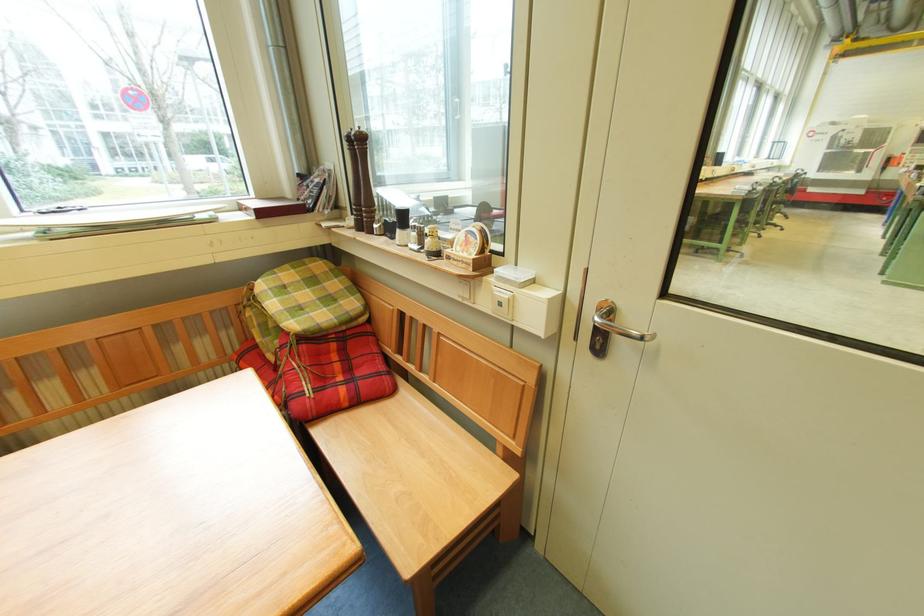
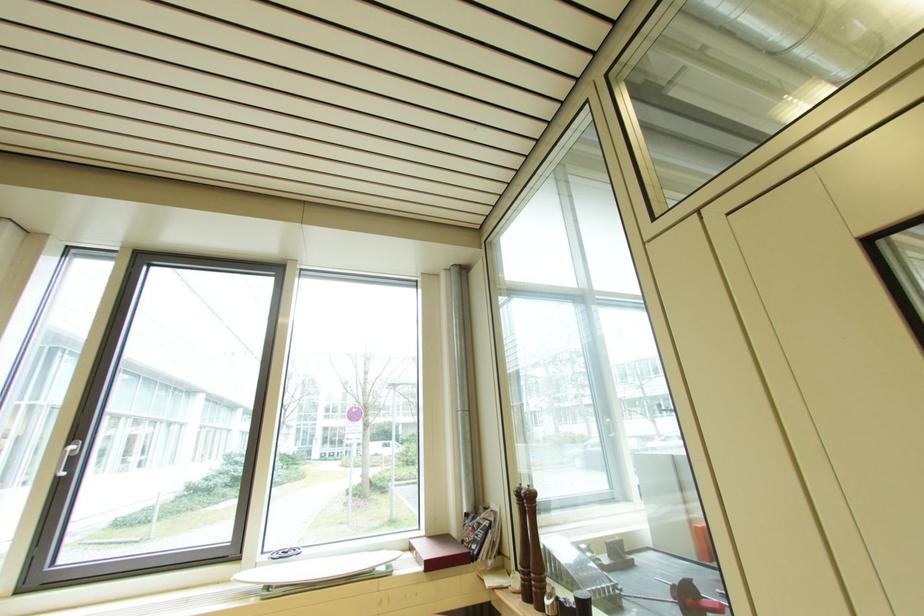
Find the pixel in the second image that matches (x=354, y=144) in the first image.

(524, 498)